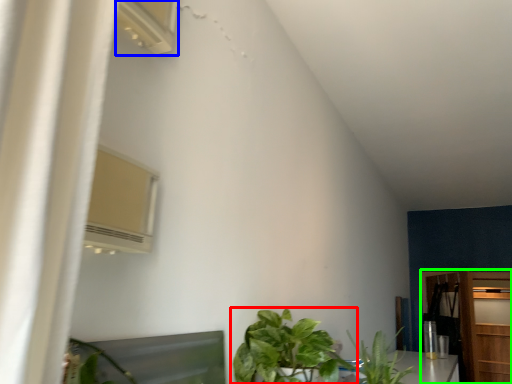
Question: Which object is the closest to the houseplant (highlighted by a red box)? Choose among these: air conditioner (highlighted by a blue box) or dresser (highlighted by a green box).

Choices:
 (A) air conditioner
 (B) dresser

Answer: (A)